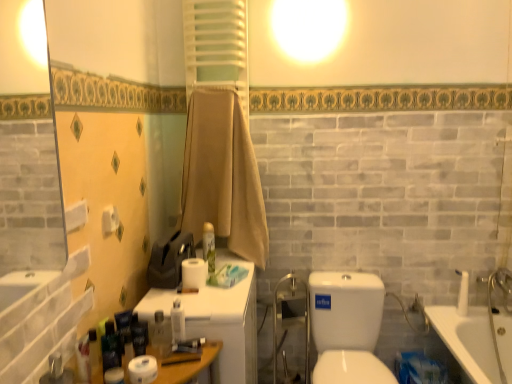
Question: Is white plastic medicine cabinet at center smaller than white matte roll of toilet paper at lower left, positioned as the first toiletry in front-to-back order?

Choices:
 (A) yes
 (B) no

Answer: (B)

Question: From a real-world perspective, is white plastic medicine cabinet at center positioned over white matte roll of toilet paper at lower left, the 4th toiletry when ordered from right to left, based on gravity?

Choices:
 (A) no
 (B) yes

Answer: (A)

Question: Could you tell me if white plastic medicine cabinet at center is turned towards white matte roll of toilet paper at lower left, the 4th toiletry when ordered from right to left?

Choices:
 (A) yes
 (B) no

Answer: (B)

Question: Is white plastic medicine cabinet at center far from white matte roll of toilet paper at lower left, positioned as the first toiletry in front-to-back order?

Choices:
 (A) yes
 (B) no

Answer: (B)

Question: Can you confirm if white plastic medicine cabinet at center is thinner than white matte roll of toilet paper at lower left, positioned as the first toiletry in front-to-back order?

Choices:
 (A) no
 (B) yes

Answer: (A)

Question: Is point (206, 249) positioned closer to the camera than point (138, 331)?

Choices:
 (A) closer
 (B) farther

Answer: (B)

Question: From the image's perspective, is matte green spray can at center, which is counted as the first toiletry, starting from the back, located above or below matte black tube at lower left, which is counted as the third toiletry, starting from the left?

Choices:
 (A) above
 (B) below

Answer: (A)

Question: From a real-world perspective, is matte green spray can at center, positioned as the 5th toiletry in left-to-right order, above or below matte black tube at lower left, the 3th toiletry positioned from the back?

Choices:
 (A) above
 (B) below

Answer: (A)

Question: Considering the positions of matte green spray can at center, which is the fifth toiletry in front-to-back order, and matte black tube at lower left, the 3th toiletry positioned from the back, in the image, is matte green spray can at center, which is the fifth toiletry in front-to-back order, wider or thinner than matte black tube at lower left, the 3th toiletry positioned from the back,?

Choices:
 (A) wide
 (B) thin

Answer: (A)

Question: Is transparent glass shower door at center wider or thinner than matte green spray can at center, which is the fifth toiletry in front-to-back order?

Choices:
 (A) wide
 (B) thin

Answer: (A)

Question: Considering the positions of point (304, 304) and point (203, 238), is point (304, 304) closer or farther from the camera than point (203, 238)?

Choices:
 (A) farther
 (B) closer

Answer: (A)

Question: From the image's perspective, relative to matte green spray can at center, the 1th toiletry when ordered from right to left, is transparent glass shower door at center above or below?

Choices:
 (A) below
 (B) above

Answer: (A)

Question: Would you say transparent glass shower door at center is inside or outside matte green spray can at center, which is counted as the first toiletry, starting from the back?

Choices:
 (A) outside
 (B) inside

Answer: (A)

Question: Is white matte toilet paper at center, the 1th toilet paper positioned from the top, wider or thinner than white matte toilet paper at lower left, positioned as the first toilet paper in bottom-to-top order?

Choices:
 (A) thin
 (B) wide

Answer: (B)

Question: Is point (187, 284) closer or farther from the camera than point (138, 375)?

Choices:
 (A) farther
 (B) closer

Answer: (A)